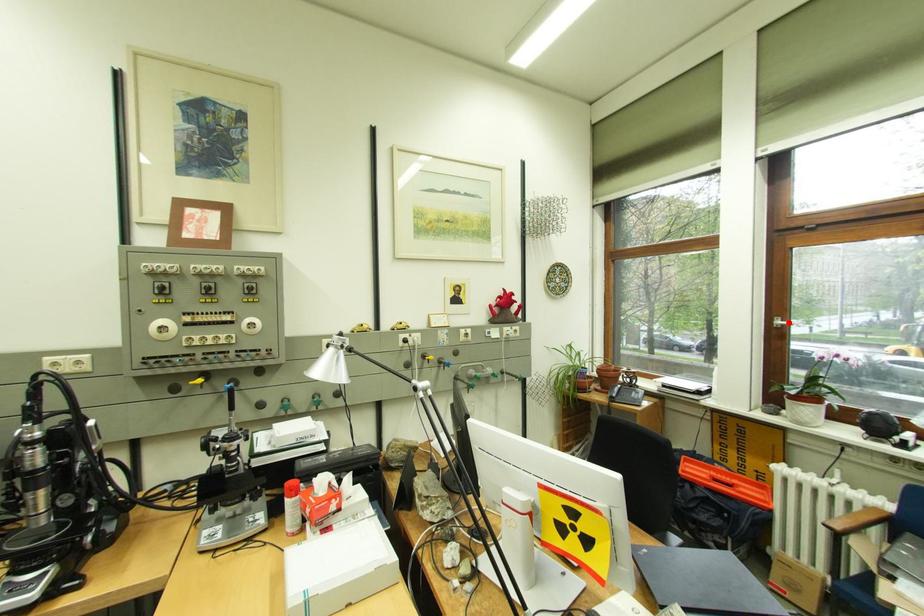
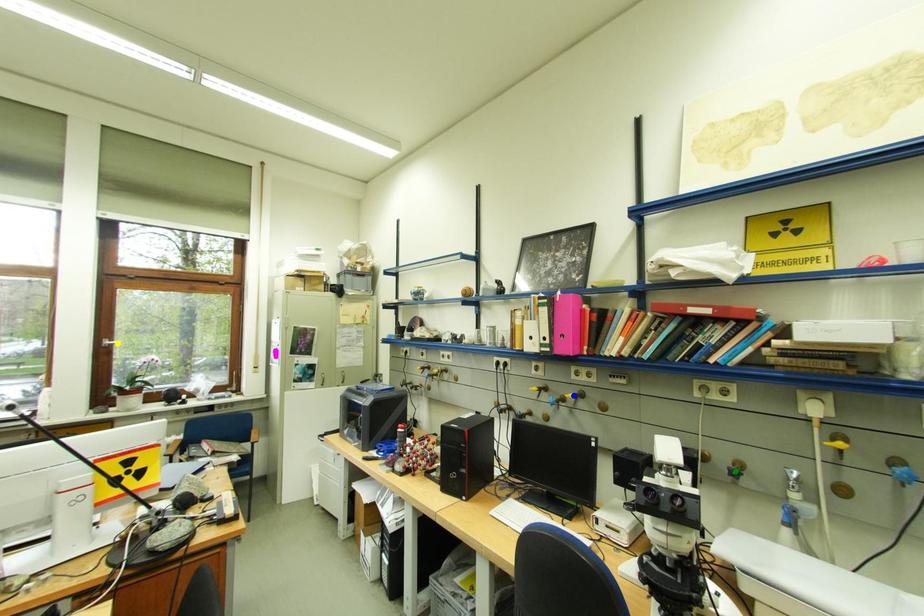
Question: I am providing you with two images of the same scene from different viewpoints. A red point is marked on the first image. You are given multiple points on the second image. Can you choose the point in image 2 that corresponds to the point in image 1?

Choices:
 (A) yellow point
 (B) blue point
 (C) green point

Answer: (A)